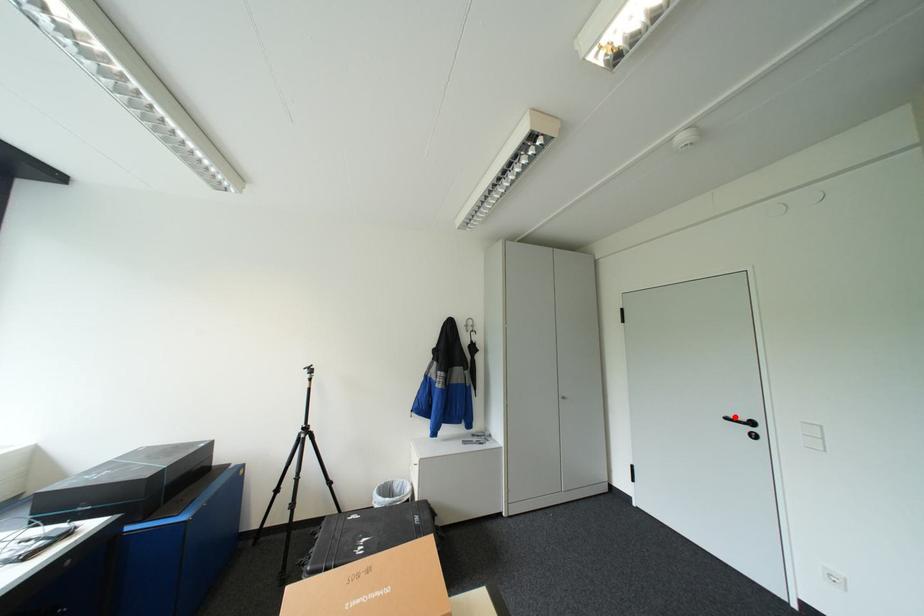
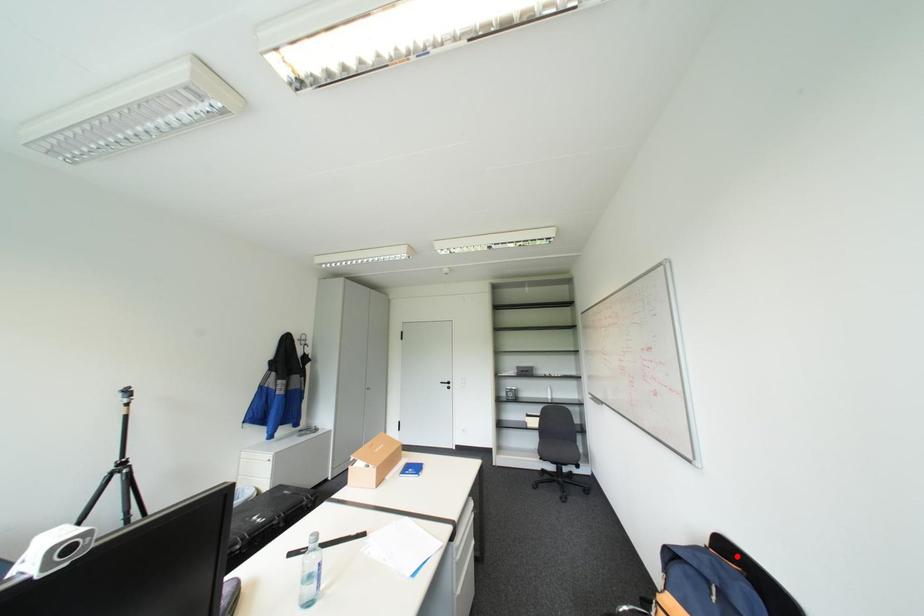
I am providing you with two images of the same scene from different viewpoints. A red point is marked on the first image and another point is marked on the second image. Are the points marked in image1 and image2 representing the same 3D position?

No